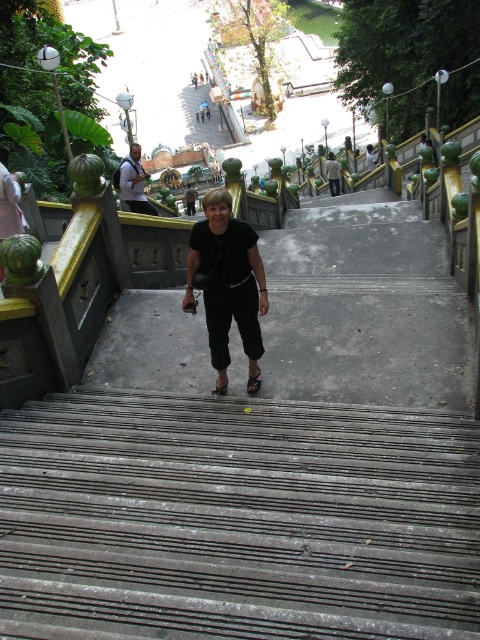
You are standing at the top of the stairs and want to greet the woman at the bottom. Which direction should you walk to get closer to the blonde hair at center without moving past the rusty metal stairs at center?

You should walk downward along the rusty metal stairs at center towards the blonde hair at center since the stairs are located below the woman.

You are standing at the base of the stairs and need to climb up to the plaza. The rusty metal stairs at center are the only path. If your maximum comfortable climbing distance is 2 meters, can you safely climb them?

The rusty metal stairs at center are 2.11 meters away from the viewer, which exceeds your maximum comfortable climbing distance of 2 meters. Therefore, it might not be safe to climb them.